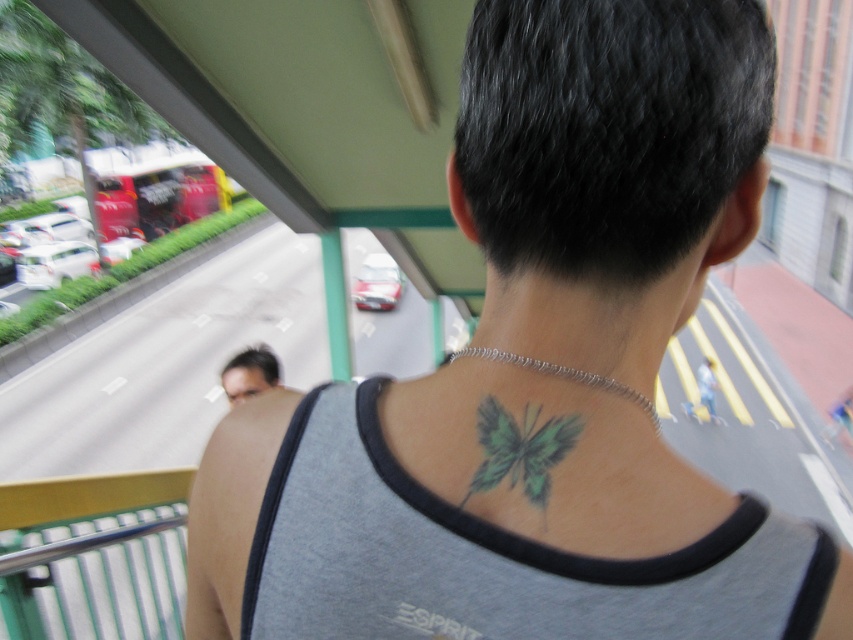
Question: Is green tattoo at center positioned at the back of green matte butterfly at upper center?

Choices:
 (A) yes
 (B) no

Answer: (A)

Question: Which point is closer to the camera?

Choices:
 (A) smooth skin face at center
 (B) green matte butterfly at upper center

Answer: (B)

Question: From the image, what is the correct spatial relationship of green matte butterfly at upper center in relation to smooth skin face at center?

Choices:
 (A) above
 (B) below

Answer: (A)

Question: Which object appears farthest from the camera in this image?

Choices:
 (A) green tattoo at center
 (B) smooth skin face at center

Answer: (B)

Question: Does green tattoo at center appear on the right side of smooth skin face at center?

Choices:
 (A) yes
 (B) no

Answer: (A)

Question: Which is farther from the smooth skin face at center?

Choices:
 (A) green matte butterfly at upper center
 (B) green tattoo at center

Answer: (A)